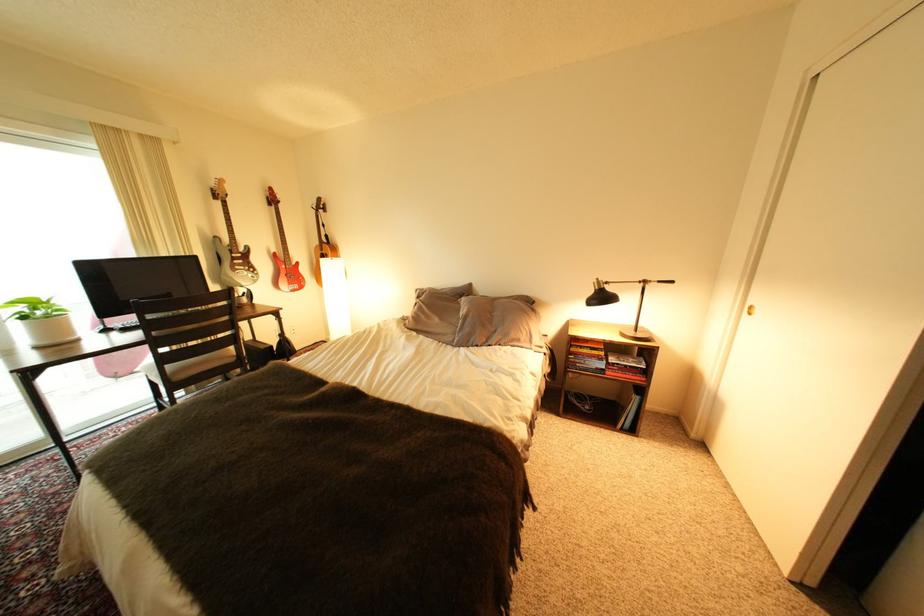
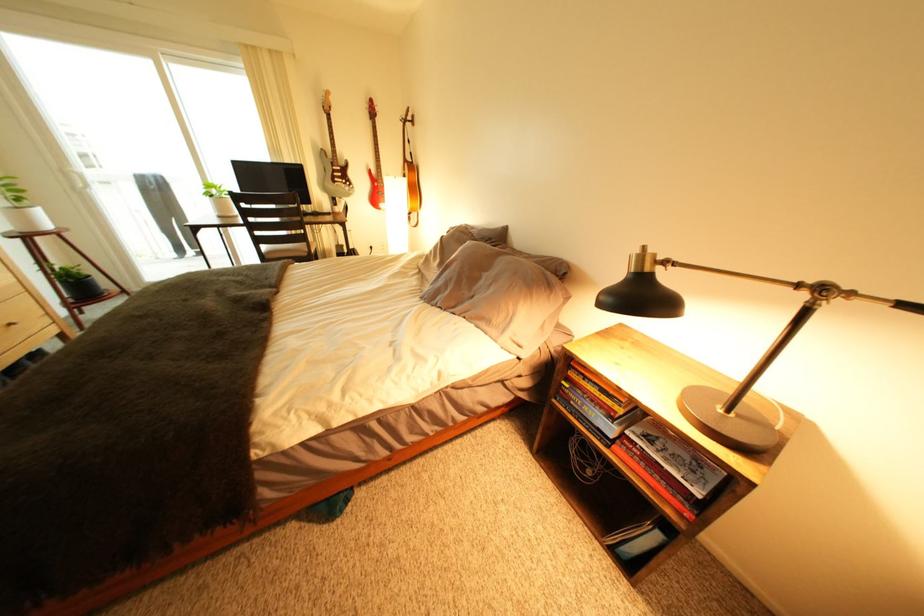
Locate, in the second image, the point that corresponds to (x=531, y=342) in the first image.

(503, 323)